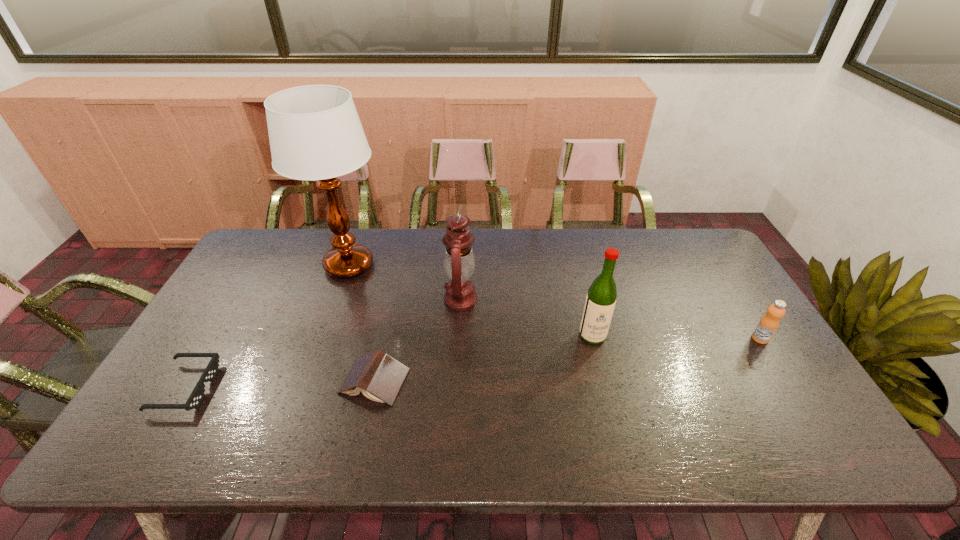
Where is `vacant space at the right edge`? vacant space at the right edge is located at coordinates (707, 289).

Identify the location of free space at the far left corner of the desktop. (255, 243).

In the image, there is a desktop. What are the coordinates of `vacant space at the far right corner` in the screenshot? It's located at (675, 232).

In the image, there is a desktop. Identify the location of vacant area at the near right corner. (781, 425).

Image resolution: width=960 pixels, height=540 pixels. I want to click on free area in between the second shortest object and the table lamp, so click(x=362, y=323).

Where is `empty location between the sunglasses and the orange juice`? empty location between the sunglasses and the orange juice is located at coordinates (472, 363).

Where is `vacant space that is in between the rightmost object and the liquor`? The image size is (960, 540). vacant space that is in between the rightmost object and the liquor is located at coordinates tap(676, 337).

The image size is (960, 540). Identify the location of free space between the tallest object and the oil lamp. (405, 282).

Identify the location of vacant space that's between the leftmost object and the oil lamp. (324, 343).

You are a GUI agent. You are given a task and a screenshot of the screen. Output one action in this format:
    pyautogui.click(x=<x>, y=<y>)
    Task: Click on the vacant region between the oil lamp and the leftmost object
    The image size is (960, 540).
    Given the screenshot: What is the action you would take?
    point(324,343)